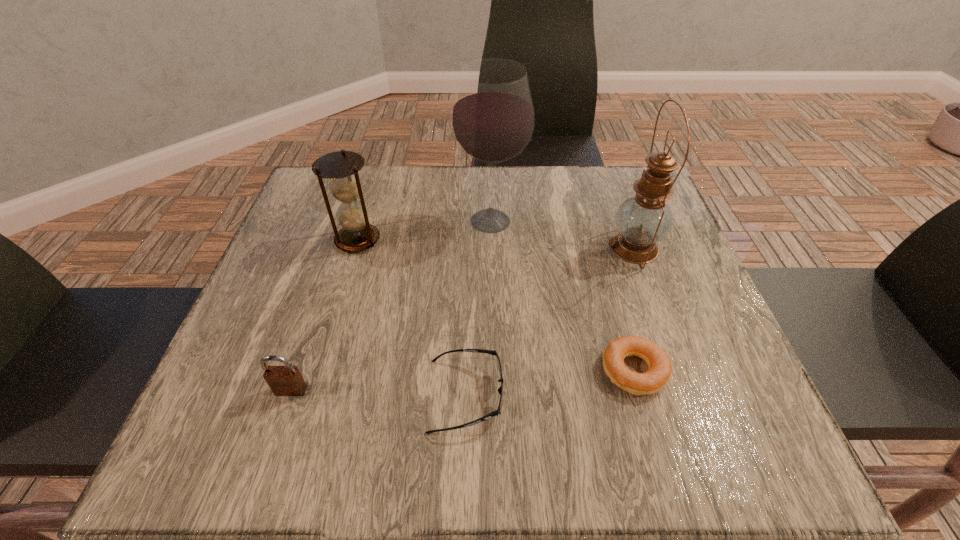
Find the location of a particular element. The width and height of the screenshot is (960, 540). free space between the shortest object and the sunglasses is located at coordinates (550, 383).

The height and width of the screenshot is (540, 960). Find the location of `vacant space that's between the oil lamp and the hourglass`. vacant space that's between the oil lamp and the hourglass is located at coordinates (496, 244).

I want to click on vacant area that lies between the second shortest object and the padlock, so click(378, 393).

Find the location of a particular element. vacant area that lies between the hourglass and the shortest object is located at coordinates (496, 305).

Image resolution: width=960 pixels, height=540 pixels. In order to click on object that is the fifth nearest to the padlock in this screenshot , I will do `click(642, 220)`.

Choose which object is the fourth nearest neighbor to the shortest object. Please provide its 2D coordinates. Your answer should be formatted as a tuple, i.e. [(x, y)], where the tuple contains the x and y coordinates of a point satisfying the conditions above.

[(341, 167)]

In order to click on free space in the image that satisfies the following two spatial constraints: 1. on the front side of the shortest object; 2. on the front-facing side of the sunglasses in this screenshot , I will do `click(641, 395)`.